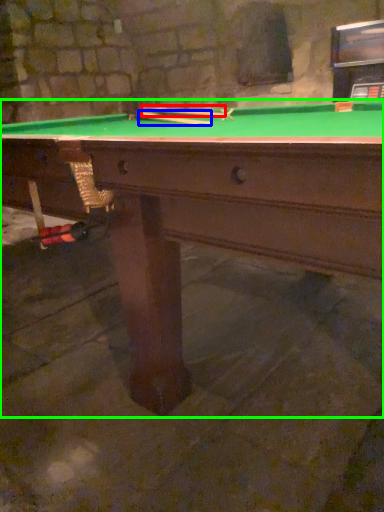
Question: Estimate the real-world distances between objects in this image. Which object is closer to cue (highlighted by a red box), cue (highlighted by a blue box) or billiard table (highlighted by a green box)?

Choices:
 (A) cue
 (B) billiard table

Answer: (A)